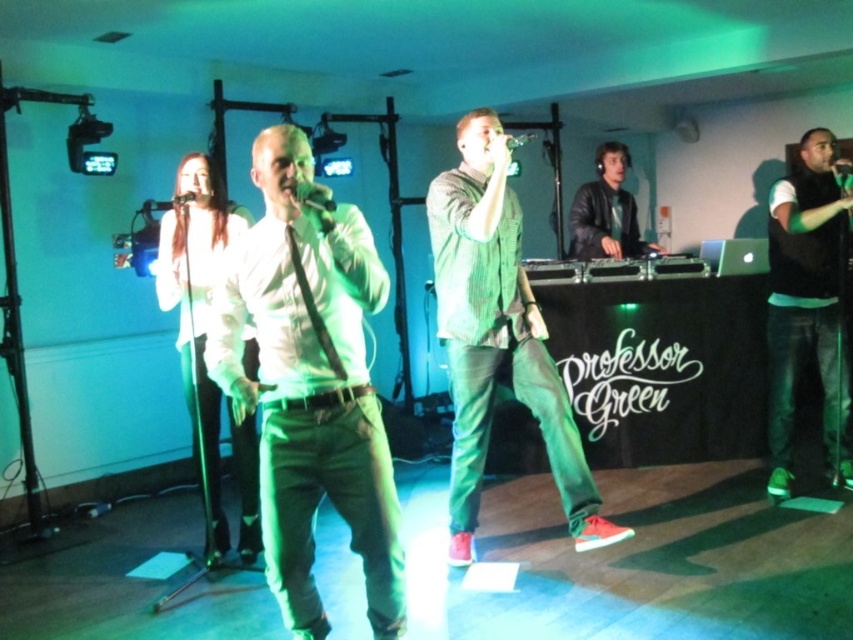
Does white matte shirt at center have a smaller size compared to black leather jacket at center?

No, white matte shirt at center is not smaller than black leather jacket at center.

Can you confirm if white matte shirt at center is positioned below black leather jacket at center?

Correct, white matte shirt at center is located below black leather jacket at center.

Is point (297, 172) closer to camera compared to point (613, 221)?

Yes, it is in front of point (613, 221).

Locate an element on the screen. white matte shirt at center is located at coordinates (310, 381).

Is white matte shirt at left to the right of black leather jacket at center from the viewer's perspective?

In fact, white matte shirt at left is to the left of black leather jacket at center.

What do you see at coordinates (196, 308) in the screenshot?
I see `white matte shirt at left` at bounding box center [196, 308].

In order to click on white matte shirt at left in this screenshot , I will do [x=196, y=308].

Does green textured shirt at center have a smaller size compared to metallic silver microphone at upper center?

Actually, green textured shirt at center might be larger than metallic silver microphone at upper center.

Can you confirm if green textured shirt at center is positioned above metallic silver microphone at upper center?

No.

What do you see at coordinates (497, 337) in the screenshot? I see `green textured shirt at center` at bounding box center [497, 337].

Find the location of a particular element. This screenshot has height=640, width=853. green textured shirt at center is located at coordinates (497, 337).